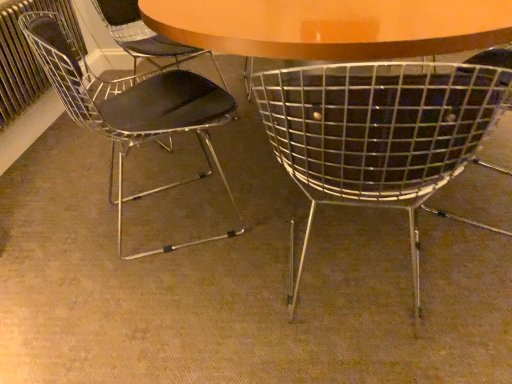
This screenshot has width=512, height=384. In order to click on unoccupied space behind metallic wire chair at left, which appears as the 2th chair when viewed from the right in this screenshot , I will do `click(181, 156)`.